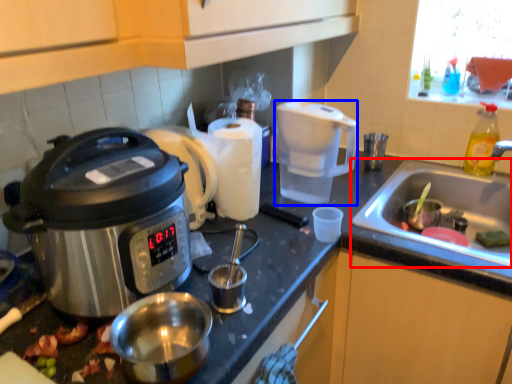
Question: Among these objects, which one is farthest to the camera, sink (highlighted by a red box) or coffee maker (highlighted by a blue box)?

Choices:
 (A) sink
 (B) coffee maker

Answer: (B)